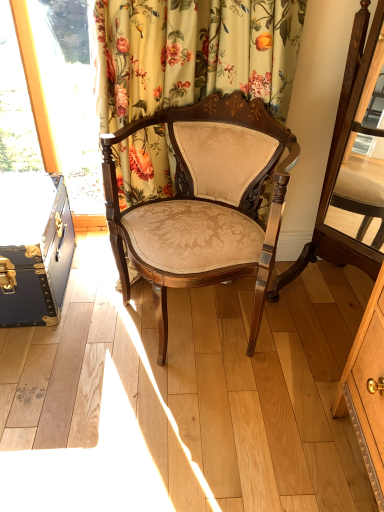
This screenshot has height=512, width=384. I want to click on free space in front of matte gold upholstery chair at center, so click(190, 431).